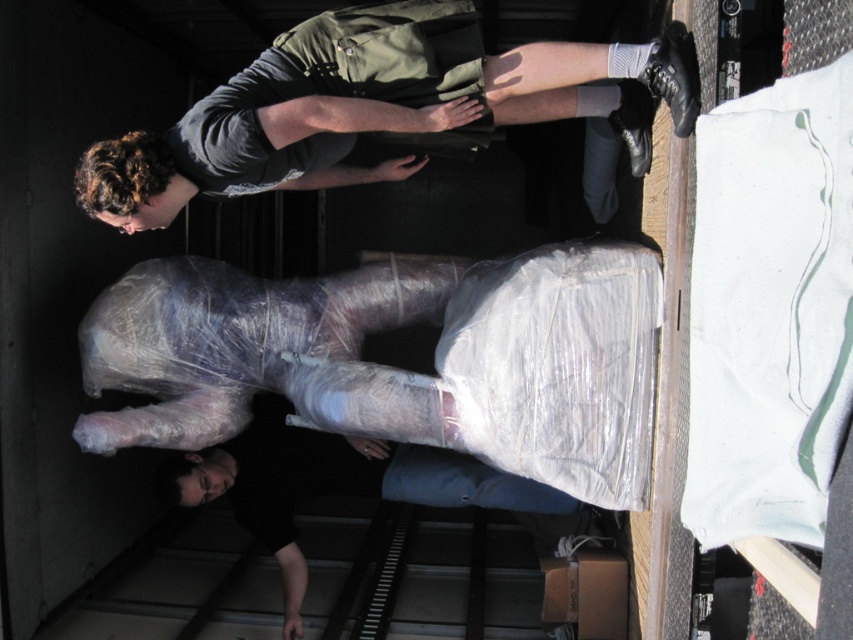
Between dark gray t-shirt at upper center and black matte shirt at lower center, which one has more height?

Standing taller between the two is black matte shirt at lower center.

How distant is dark gray t-shirt at upper center from black matte shirt at lower center?

dark gray t-shirt at upper center and black matte shirt at lower center are 3.78 feet apart from each other.

Who is more forward, (100, 145) or (492, 476)?

Point (100, 145) is in front.

Find the location of a particular element. Image resolution: width=853 pixels, height=640 pixels. dark gray t-shirt at upper center is located at coordinates (370, 108).